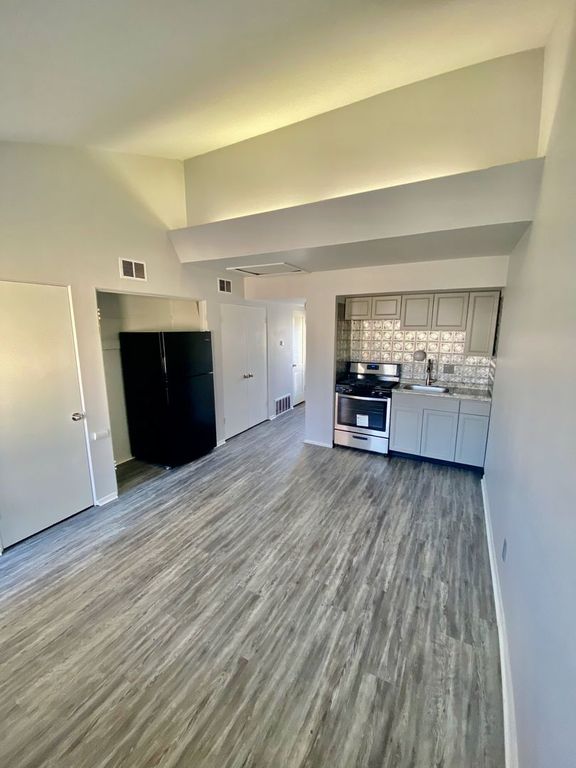
Identify the location of cabinets. (419, 313).